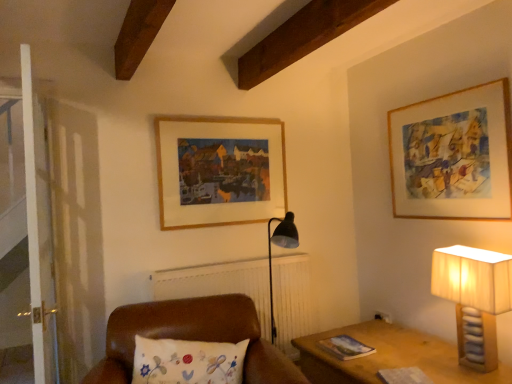
Question: Looking at the image, does beige fabric lampshade at right seem bigger or smaller compared to leather cushion at center?

Choices:
 (A) small
 (B) big

Answer: (A)

Question: From a real-world perspective, is beige fabric lampshade at right physically located above or below leather cushion at center?

Choices:
 (A) below
 (B) above

Answer: (B)

Question: Estimate the real-world distances between objects in this image. Which object is farther from the beige fabric lampshade at right?

Choices:
 (A) leather cushion at center
 (B) wooden frame at upper right, the second picture frame in the left-to-right sequence
 (C) wooden picture frame at upper center, placed as the first picture frame when sorted from left to right

Answer: (C)

Question: Which object is the closest to the beige fabric lampshade at right?

Choices:
 (A) wooden frame at upper right, the second picture frame in the left-to-right sequence
 (B) wooden picture frame at upper center, arranged as the 2th picture frame when viewed from the right
 (C) leather cushion at center

Answer: (A)